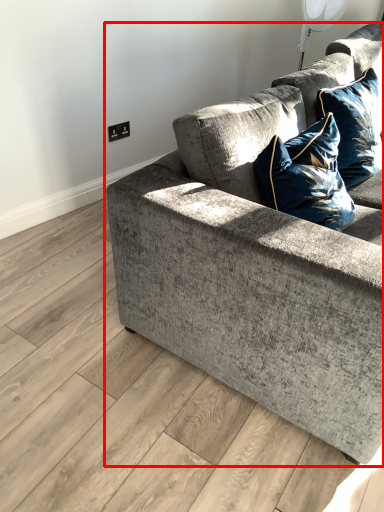
Question: From the image's perspective, considering the relative positions of studio couch (annotated by the red box) and pillow in the image provided, where is studio couch (annotated by the red box) located with respect to the staircase?

Choices:
 (A) below
 (B) above

Answer: (A)